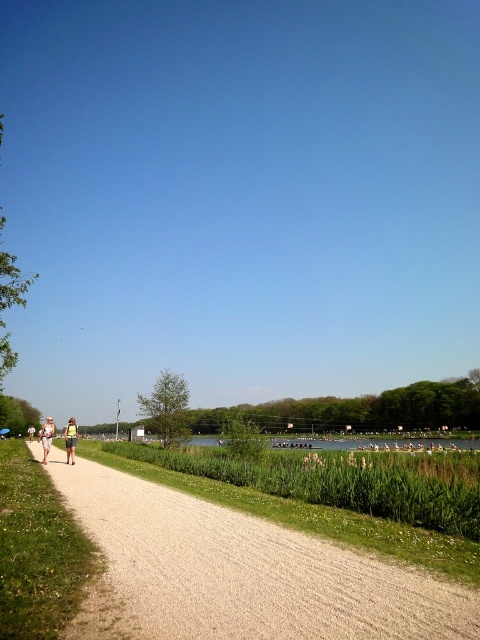
Can you confirm if light beige fabric couple at center is thinner than light beige shorts at center?

Correct, light beige fabric couple at center's width is less than light beige shorts at center's.

Is light beige fabric couple at center closer to the viewer compared to light beige shorts at center?

No, light beige fabric couple at center is further to the viewer.

Who is more forward, (64, 428) or (76, 438)?

Positioned in front is point (76, 438).

Identify the location of light beige fabric couple at center. The height and width of the screenshot is (640, 480). (47, 436).

Does gravel path at left have a smaller size compared to light beige fabric couple at center?

Yes, gravel path at left is smaller than light beige fabric couple at center.

Who is lower down, gravel path at left or light beige fabric couple at center?

light beige fabric couple at center is lower down.

Does point (64, 464) come in front of point (39, 440)?

Yes, it is.

In order to click on gravel path at left in this screenshot , I will do `click(240, 572)`.

Does light beige fabric couple at center have a lesser width compared to light beige fabric jacket at left?

Yes, light beige fabric couple at center is thinner than light beige fabric jacket at left.

Does light beige fabric couple at center have a lesser height compared to light beige fabric jacket at left?

Correct, light beige fabric couple at center is not as tall as light beige fabric jacket at left.

Between point (44, 449) and point (46, 442), which one is positioned in front?

Point (46, 442)

Identify the location of light beige fabric couple at center. (47, 436).